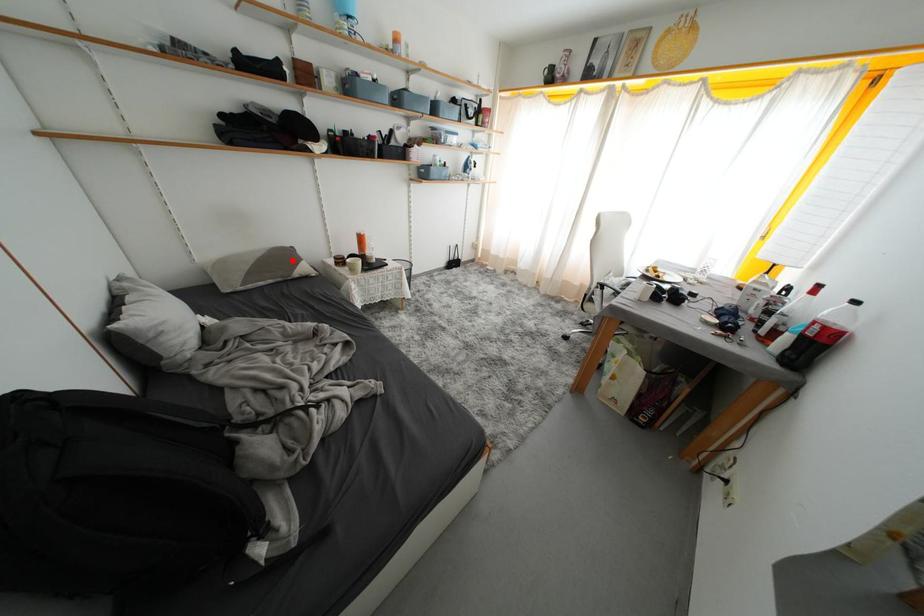
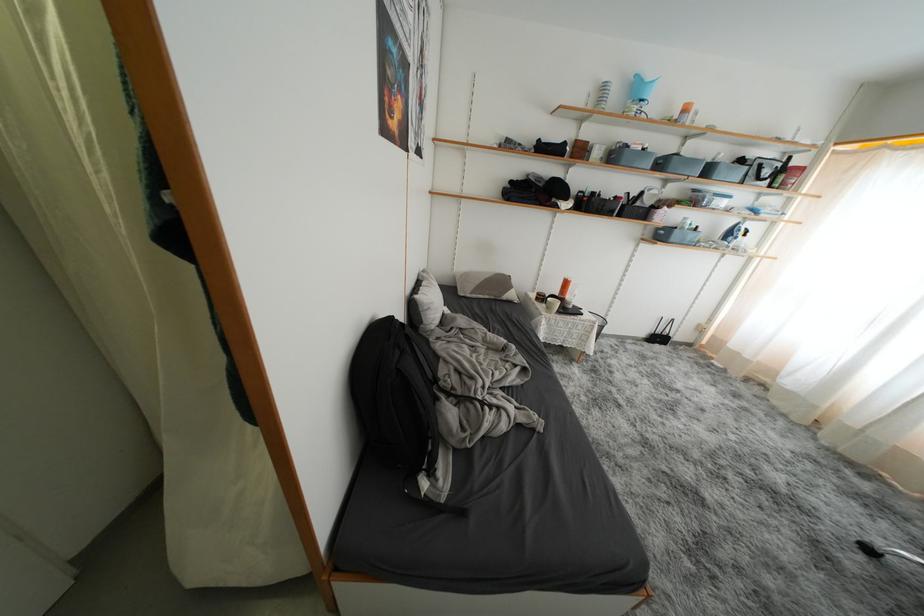
Question: I am providing you with two images of the same scene from different viewpoints. A red point is shown in image1. For the corresponding object point in image2, is it positioned nearer or farther from the camera?

Choices:
 (A) Nearer
 (B) Farther

Answer: (B)